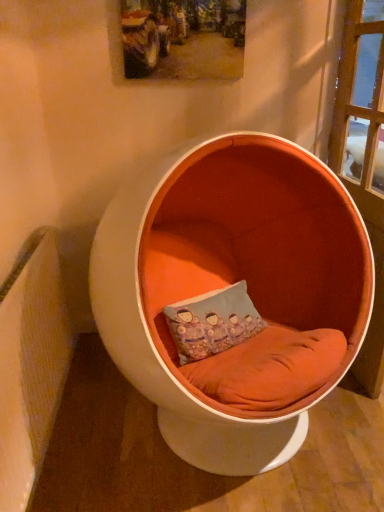
In order to face orange fabric chair at center, should I rotate leftwards or rightwards?

Rotate your view right by about 4.684°.

The width and height of the screenshot is (384, 512). I want to click on wooden textured picture frame at upper center, so click(183, 39).

From a real-world perspective, between blue fabric pillow at center and orange fabric chair at center, who is vertically higher?

orange fabric chair at center, from a real-world perspective.

Is blue fabric pillow at center oriented away from orange fabric chair at center?

Yes.

Are blue fabric pillow at center and orange fabric chair at center located far from each other?

That's not correct — blue fabric pillow at center is a little close to orange fabric chair at center.

Is blue fabric pillow at center thinner than orange fabric chair at center?

Yes.

Is wooden textured picture frame at upper center inside or outside of blue fabric pillow at center?

wooden textured picture frame at upper center cannot be found inside blue fabric pillow at center.

Considering the positions of objects wooden textured picture frame at upper center and blue fabric pillow at center in the image provided, who is more to the left, wooden textured picture frame at upper center or blue fabric pillow at center?

wooden textured picture frame at upper center.

Locate an element on the screen. picture frame to the left of blue fabric pillow at center is located at coordinates (183, 39).

Is wooden textured picture frame at upper center closer to the viewer compared to blue fabric pillow at center?

No, the depth of wooden textured picture frame at upper center is greater than that of blue fabric pillow at center.

Consider the image. Considering the relative positions of blue fabric pillow at center and wooden textured picture frame at upper center in the image provided, is blue fabric pillow at center to the left of wooden textured picture frame at upper center from the viewer's perspective?

In fact, blue fabric pillow at center is to the right of wooden textured picture frame at upper center.

Locate an element on the screen. The height and width of the screenshot is (512, 384). picture frame behind the blue fabric pillow at center is located at coordinates (183, 39).

Which is in front, point (185, 347) or point (143, 59)?

Point (185, 347)

Consider the image. Does blue fabric pillow at center turn towards wooden textured picture frame at upper center?

No, blue fabric pillow at center is not oriented towards wooden textured picture frame at upper center.

How far apart are orange fabric chair at center and wooden textured picture frame at upper center?

orange fabric chair at center and wooden textured picture frame at upper center are 76.46 centimeters apart from each other.

From the image's perspective, would you say orange fabric chair at center is shown under wooden textured picture frame at upper center?

Yes.

Between orange fabric chair at center and wooden textured picture frame at upper center, which one has larger size?

orange fabric chair at center is bigger.

Which is in front, orange fabric chair at center or wooden textured picture frame at upper center?

orange fabric chair at center.

In the scene shown: Does orange fabric chair at center have a lesser width compared to blue fabric pillow at center?

In fact, orange fabric chair at center might be wider than blue fabric pillow at center.

Could you tell me if orange fabric chair at center is facing blue fabric pillow at center?

Yes, orange fabric chair at center faces towards blue fabric pillow at center.

Does orange fabric chair at center lie in front of blue fabric pillow at center?

Yes.

Considering the sizes of objects orange fabric chair at center and blue fabric pillow at center in the image provided, who is bigger, orange fabric chair at center or blue fabric pillow at center?

orange fabric chair at center.

From the image's perspective, is wooden textured picture frame at upper center located above orange fabric chair at center?

Yes, from the image's perspective, wooden textured picture frame at upper center is over orange fabric chair at center.

From a real-world perspective, which object stands above the other?

In real-world perspective, wooden textured picture frame at upper center is above.

From the picture: Is wooden textured picture frame at upper center directly adjacent to orange fabric chair at center?

No, wooden textured picture frame at upper center is not in contact with orange fabric chair at center.

Image resolution: width=384 pixels, height=512 pixels. Find the location of `pillow below the orange fabric chair at center (from the image's perspective)`. pillow below the orange fabric chair at center (from the image's perspective) is located at coordinates (212, 322).

The height and width of the screenshot is (512, 384). In order to click on pillow on the right of wooden textured picture frame at upper center in this screenshot , I will do `click(212, 322)`.

From the picture: Considering their positions, is blue fabric pillow at center positioned further to orange fabric chair at center than wooden textured picture frame at upper center?

Based on the image, wooden textured picture frame at upper center appears to be further to orange fabric chair at center.

In the scene shown: Estimate the real-world distances between objects in this image. Which object is further from wooden textured picture frame at upper center, blue fabric pillow at center or orange fabric chair at center?

blue fabric pillow at center is positioned further to the anchor wooden textured picture frame at upper center.

Looking at the image, which one is located further to wooden textured picture frame at upper center, orange fabric chair at center or blue fabric pillow at center?

blue fabric pillow at center is further to wooden textured picture frame at upper center.

Looking at the image, which one is located closer to orange fabric chair at center, wooden textured picture frame at upper center or blue fabric pillow at center?

blue fabric pillow at center is positioned closer to the anchor orange fabric chair at center.

Considering their positions, is orange fabric chair at center positioned closer to blue fabric pillow at center than wooden textured picture frame at upper center?

The object closer to blue fabric pillow at center is orange fabric chair at center.

Considering their positions, is wooden textured picture frame at upper center positioned further to blue fabric pillow at center than orange fabric chair at center?

wooden textured picture frame at upper center.

You are a GUI agent. You are given a task and a screenshot of the screen. Output one action in this format:
    pyautogui.click(x=<x>, y=<y>)
    Task: Click on the furniture between wooden textured picture frame at upper center and blue fabric pillow at center vertically
    
    Given the screenshot: What is the action you would take?
    tap(229, 286)